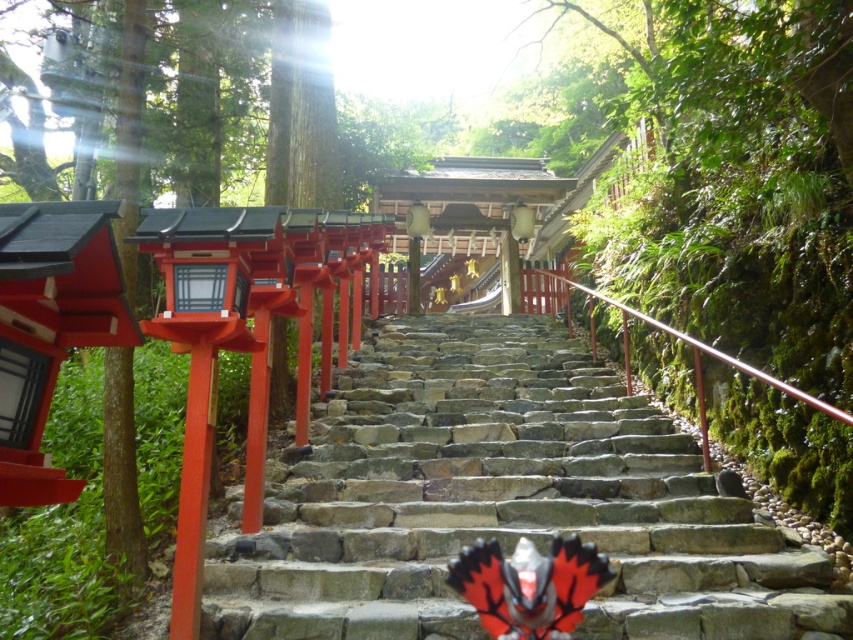
Question: Does matte white lantern at upper center have a greater width compared to matte black lantern at center?

Choices:
 (A) no
 (B) yes

Answer: (B)

Question: Considering the relative positions of shiny metallic butterfly at center and matte white lantern at upper center in the image provided, where is shiny metallic butterfly at center located with respect to matte white lantern at upper center?

Choices:
 (A) left
 (B) right

Answer: (A)

Question: Which object is farther from the camera taking this photo?

Choices:
 (A) matte black lantern at center
 (B) shiny metallic butterfly at center
 (C) matte white lantern at upper center
 (D) stone at center

Answer: (C)

Question: Which is nearer to the matte black lantern at center?

Choices:
 (A) stone at center
 (B) matte white lantern at upper center
 (C) shiny metallic butterfly at center

Answer: (B)

Question: Is stone at center closer to the viewer compared to shiny metallic butterfly at center?

Choices:
 (A) no
 (B) yes

Answer: (A)

Question: Which is nearer to the matte black lantern at center?

Choices:
 (A) stone at center
 (B) matte white lantern at upper center
 (C) shiny metallic butterfly at center

Answer: (B)